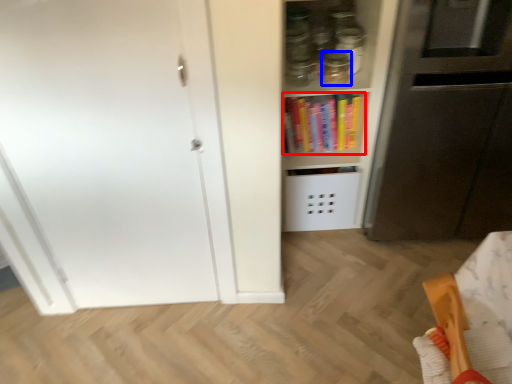
Question: Which object appears farthest to the camera in this image, book (highlighted by a red box) or glass jar (highlighted by a blue box)?

Choices:
 (A) book
 (B) glass jar

Answer: (A)